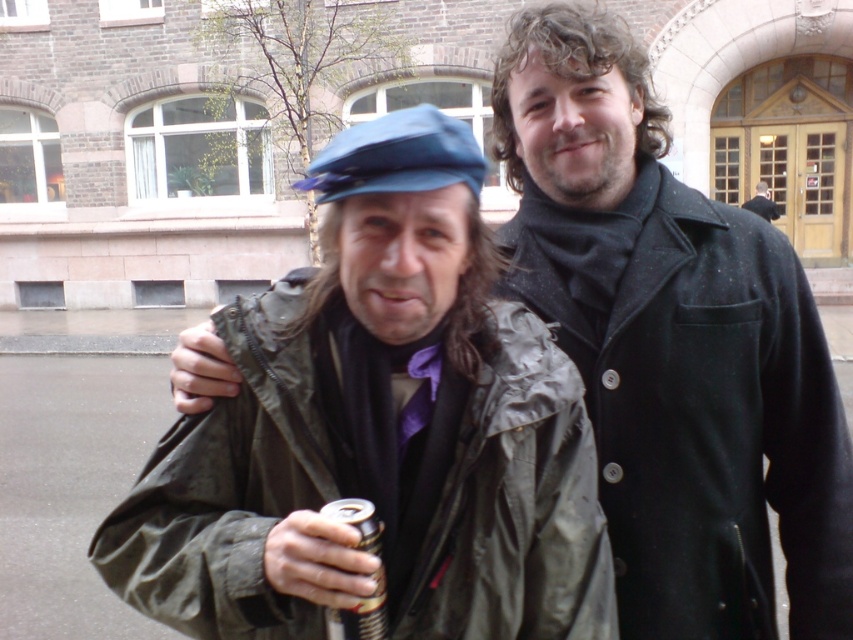
Consider the image. You are a photographer trying to capture a closeup of the blue fabric cap at center and the metallic can at lower center. Since you want both objects to appear the same size in the photo, which object should you move closer to the camera?

The metallic can at lower center should be moved closer to the camera because it is smaller than the blue fabric cap at center. To make them appear the same size in the photo, the smaller object needs to be positioned closer to the camera.

You are standing in front of a building with two people. There is a point at coordinates [329,196] in the image. If you need to place a 4.5 feet wide banner between this point and the nearest wall, will there be enough space?

The distance of point [329,196] from viewer is 5.06 feet. Since the banner requires 4.5 feet, there is enough space as 5.06 feet is greater than 4.5 feet.